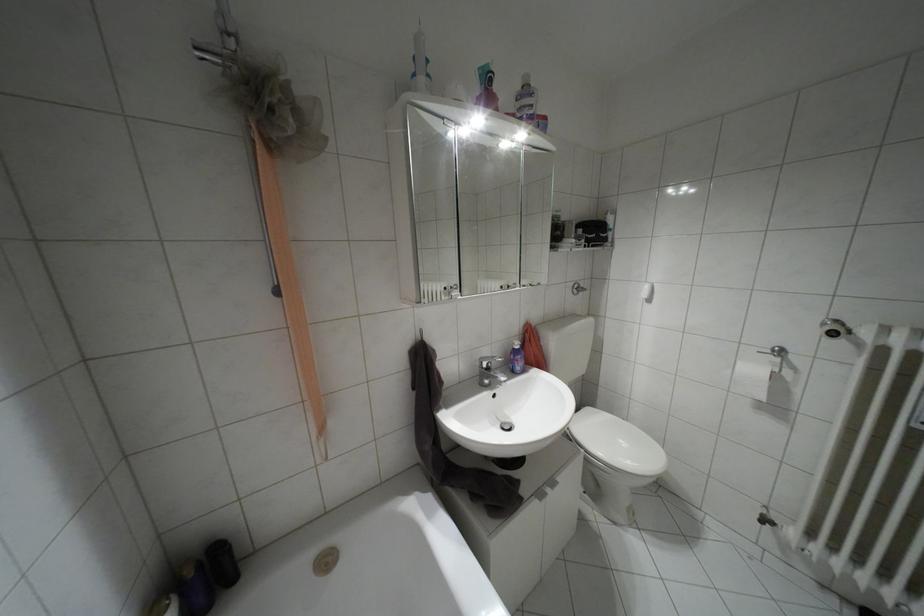
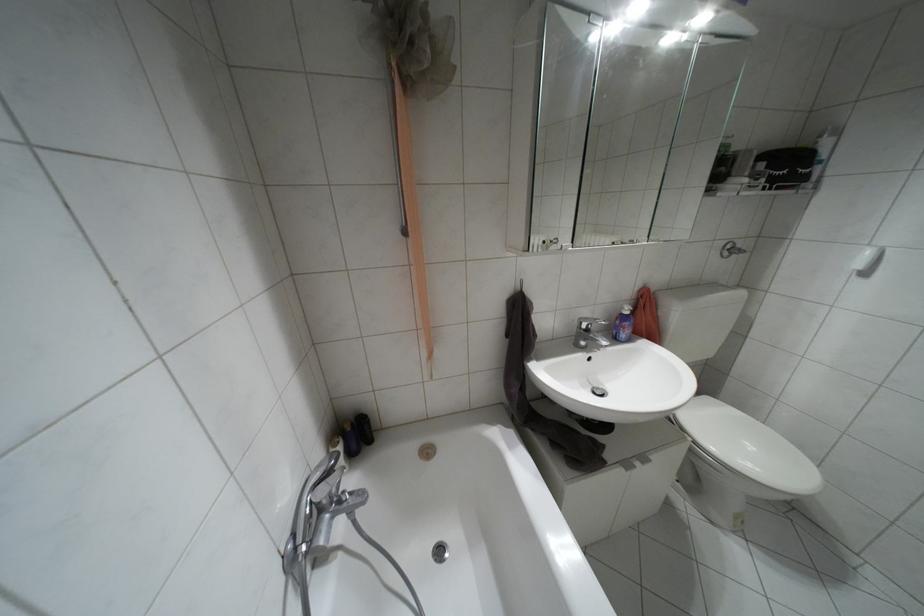
Where in the second image is the point corresponding to (x=488, y=368) from the first image?

(587, 330)